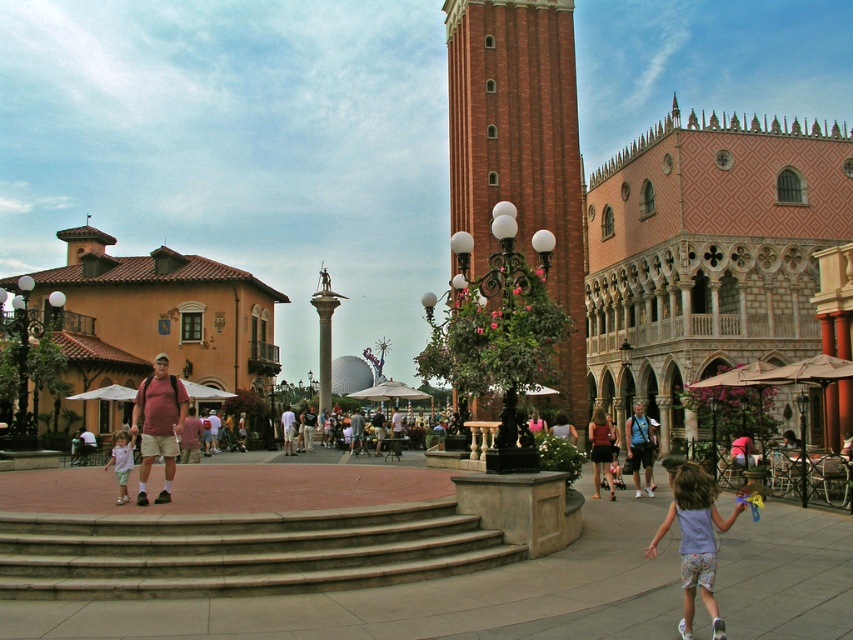
You are a photographer at the theme park and want to capture both the matte pink shirt at center and the light brown leather jacket at center in a single frame. Which object should you focus on to ensure both are in the frame without zooming in too much?

The matte pink shirt at center is larger in size than the light brown leather jacket at center, so focusing on the matte pink shirt at center will help keep both objects in the frame without excessive zooming.

Looking at this image, you are a photographer positioned in the plaza and want to capture both the matte pink dress at lower right and the light pink fabric dress at lower left in a single shot. Which dress should you focus on first to ensure both are in frame?

You should focus on the light pink fabric dress at lower left first because the matte pink dress at lower right is above it, so adjusting the camera angle to include the lower dress will naturally capture the one above as well.

You are a photographer positioned in the plaza and want to capture both the matte pink dress at lower right and the light pink fabric dress at lower left in your shot. Which dress will appear closer to the camera in the photo?

The matte pink dress at lower right will appear closer to the camera because the light pink fabric dress at lower left is positioned behind it.